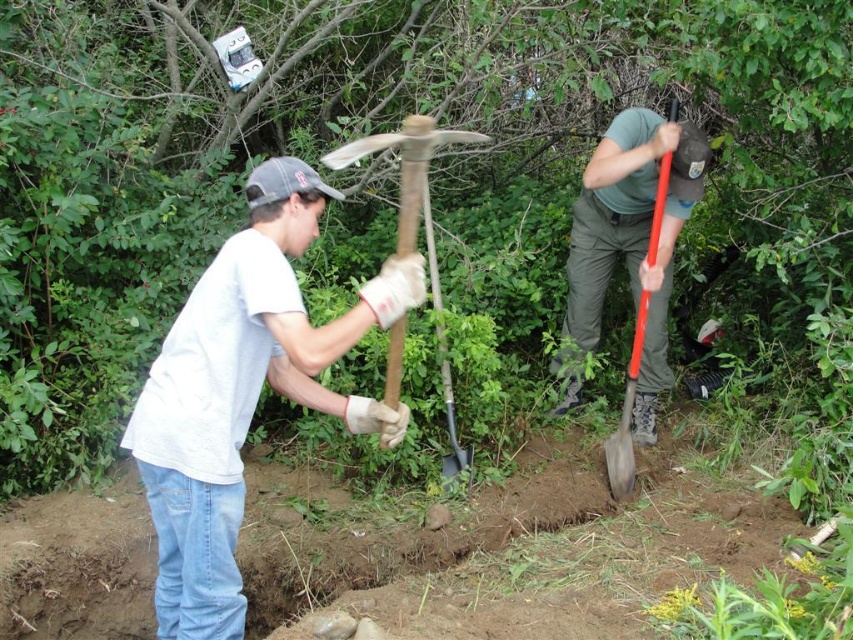
Question: Among these points, which one is nearest to the camera?

Choices:
 (A) (650, 225)
 (B) (196, 486)
 (C) (403, 321)

Answer: (B)

Question: Which of the following is the farthest from the observer?

Choices:
 (A) (663, 208)
 (B) (427, 148)

Answer: (A)

Question: Is wooden pickaxe at center smaller than gray fabric baseball cap at upper center?

Choices:
 (A) yes
 (B) no

Answer: (B)

Question: Which point is farther to the camera?

Choices:
 (A) (274, 188)
 (B) (386, 435)
 (C) (659, 227)

Answer: (C)

Question: Does green matte shovel at center appear on the left side of red plastic shovel at upper right?

Choices:
 (A) no
 (B) yes

Answer: (B)

Question: Can you confirm if wooden pickaxe at center is positioned below red plastic shovel at upper right?

Choices:
 (A) no
 (B) yes

Answer: (B)